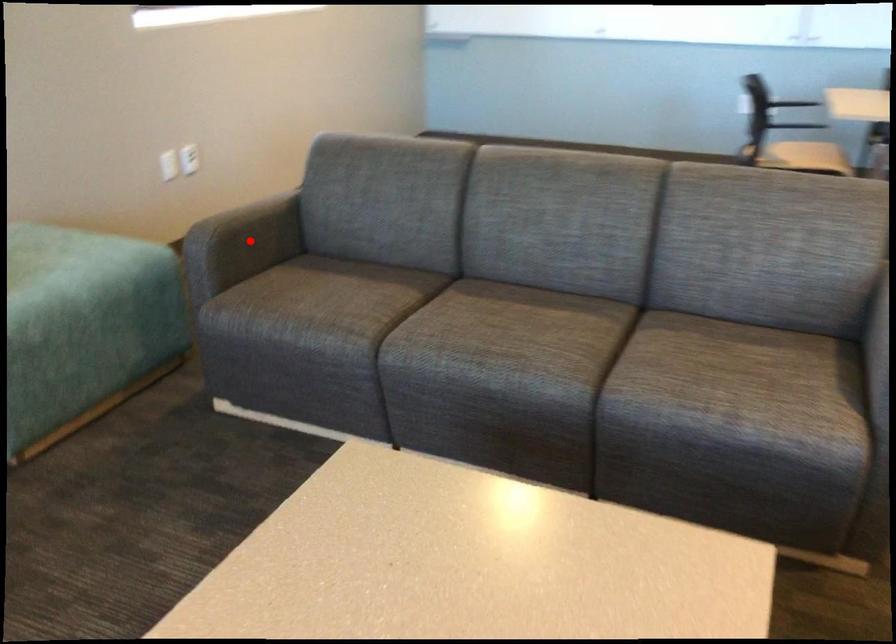
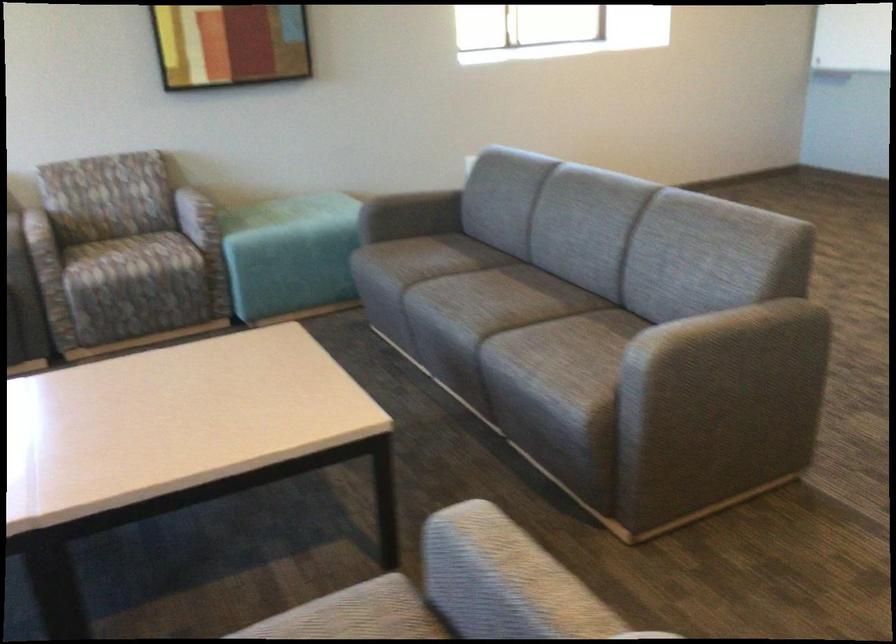
Question: I am providing you with two images of the same scene from different viewpoints. Image1 has a red point marked. In image2, the corresponding 3D location appears at what relative position? Reply with the corresponding letter.

Choices:
 (A) Closer
 (B) Farther

Answer: (B)